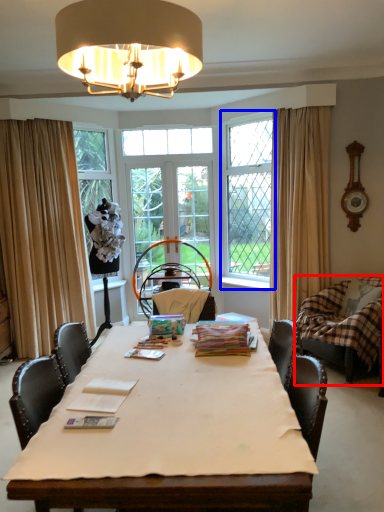
Question: Which of the following is the farthest to the observer, swivel chair (highlighted by a red box) or window (highlighted by a blue box)?

Choices:
 (A) swivel chair
 (B) window

Answer: (B)